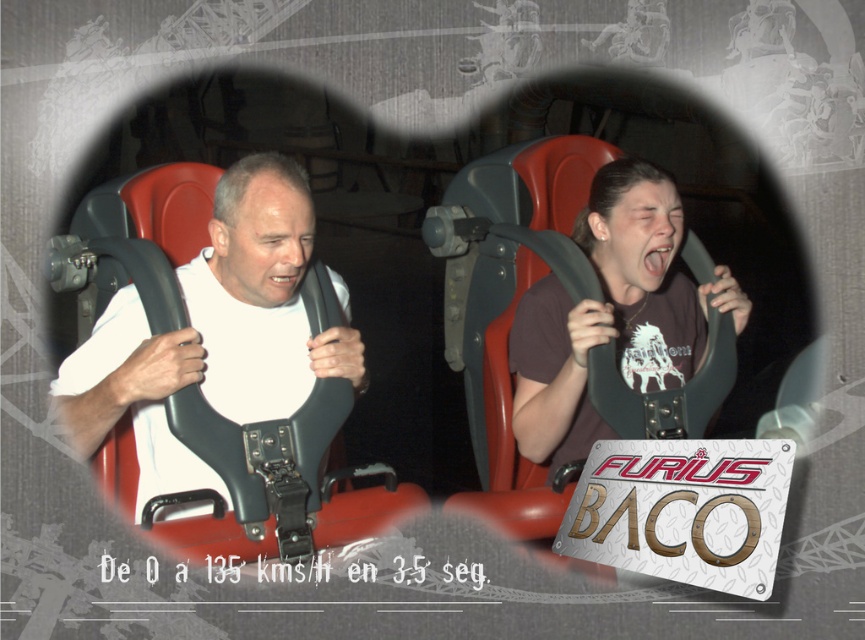
Does matte white shirt at left appear over metallic/textured sign at center-right?

Indeed, matte white shirt at left is positioned over metallic/textured sign at center-right.

Measure the distance between matte white shirt at left and metallic/textured sign at center-right.

matte white shirt at left is 1.25 meters away from metallic/textured sign at center-right.

Does point (270, 204) come closer to viewer compared to point (565, 525)?

That is False.

Image resolution: width=865 pixels, height=640 pixels. I want to click on matte white shirt at left, so click(215, 333).

Can you confirm if matte white shirt at left is thinner than brown matte shirt at center?

Incorrect, matte white shirt at left's width is not less than brown matte shirt at center's.

Does matte white shirt at left have a lesser height compared to brown matte shirt at center?

Yes.

Identify the location of matte white shirt at left. (215, 333).

Where is `matte white shirt at left`? matte white shirt at left is located at coordinates coord(215,333).

Between brown matte shirt at center and metallic/textured sign at center-right, which one appears on the right side from the viewer's perspective?

From the viewer's perspective, brown matte shirt at center appears more on the right side.

Is brown matte shirt at center below metallic/textured sign at center-right?

No, brown matte shirt at center is not below metallic/textured sign at center-right.

What are the coordinates of `brown matte shirt at center` in the screenshot? It's located at (612, 314).